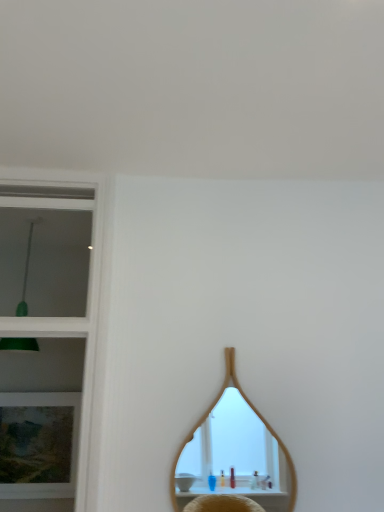
Measure the distance between point (204,466) and camera.

Point (204,466) and camera are 14.21 feet apart from each other.

Where is `wooden mirror at center`? wooden mirror at center is located at coordinates (235, 451).

The height and width of the screenshot is (512, 384). Describe the element at coordinates (235, 451) in the screenshot. I see `wooden mirror at center` at that location.

Consider the image. What is the approximate width of wooden mirror at center?

It is 0.92 inches.

At what (x,y) coordinates should I click in order to perform the action: click on matte wooden picture frame at left. Please return your answer as a coordinate pair (x, y). Looking at the image, I should click on pyautogui.click(x=38, y=444).

What do you see at coordinates (38, 444) in the screenshot? The width and height of the screenshot is (384, 512). I see `matte wooden picture frame at left` at bounding box center [38, 444].

Locate an element on the screen. Image resolution: width=384 pixels, height=512 pixels. wooden mirror at center is located at coordinates (235, 451).

Does matte wooden picture frame at left appear on the right side of wooden mirror at center?

Incorrect, matte wooden picture frame at left is not on the right side of wooden mirror at center.

Is matte wooden picture frame at left further to the viewer compared to wooden mirror at center?

Yes, the depth of matte wooden picture frame at left is greater than that of wooden mirror at center.

Does point (30, 434) lie in front of point (283, 457)?

Yes, it is.

From the image's perspective, relative to wooden mirror at center, is matte wooden picture frame at left above or below?

matte wooden picture frame at left is below wooden mirror at center.

From a real-world perspective, relative to wooden mirror at center, is matte wooden picture frame at left vertically above or below?

In terms of real-world spatial position, matte wooden picture frame at left is below wooden mirror at center.

Between matte wooden picture frame at left and wooden mirror at center, which one has larger width?

With larger width is matte wooden picture frame at left.

Between matte wooden picture frame at left and wooden mirror at center, which one has more height?

Standing taller between the two is wooden mirror at center.

Looking at the image, does matte wooden picture frame at left seem bigger or smaller compared to wooden mirror at center?

Clearly, matte wooden picture frame at left is larger in size than wooden mirror at center.

Choose the correct answer: Is matte wooden picture frame at left inside wooden mirror at center or outside it?

matte wooden picture frame at left is not enclosed by wooden mirror at center.

Is matte wooden picture frame at left far from wooden mirror at center?

matte wooden picture frame at left is far away from wooden mirror at center.

Is matte wooden picture frame at left looking in the opposite direction of wooden mirror at center?

No, wooden mirror at center is not at the back of matte wooden picture frame at left.

How different are the orientations of matte wooden picture frame at left and wooden mirror at center in degrees?

The angle between the facing direction of matte wooden picture frame at left and the facing direction of wooden mirror at center is 0.185 degrees.

How far apart are matte wooden picture frame at left and wooden mirror at center?

matte wooden picture frame at left and wooden mirror at center are 2.13 meters apart from each other.

The height and width of the screenshot is (512, 384). I want to click on picture frame below the wooden mirror at center (from a real-world perspective), so click(38, 444).

From the picture: Considering the relative positions of wooden mirror at center and matte wooden picture frame at left in the image provided, is wooden mirror at center to the right of matte wooden picture frame at left from the viewer's perspective?

Indeed, wooden mirror at center is positioned on the right side of matte wooden picture frame at left.

In the image, is wooden mirror at center positioned in front of or behind matte wooden picture frame at left?

Clearly, wooden mirror at center is in front of matte wooden picture frame at left.

Which is in front, point (278, 466) or point (20, 472)?

Point (20, 472)

From the image's perspective, which is above, wooden mirror at center or matte wooden picture frame at left?

wooden mirror at center.

From a real-world perspective, is wooden mirror at center beneath matte wooden picture frame at left?

Incorrect, from a real-world perspective, wooden mirror at center is higher than matte wooden picture frame at left.

Is wooden mirror at center wider or thinner than matte wooden picture frame at left?

Clearly, wooden mirror at center has less width compared to matte wooden picture frame at left.

Between wooden mirror at center and matte wooden picture frame at left, which one has more height?

wooden mirror at center is taller.

Who is bigger, wooden mirror at center or matte wooden picture frame at left?

matte wooden picture frame at left is bigger.

Is matte wooden picture frame at left a part of wooden mirror at center?

No, wooden mirror at center does not contain matte wooden picture frame at left.

Would you consider wooden mirror at center to be distant from matte wooden picture frame at left?

That's right, there is a large distance between wooden mirror at center and matte wooden picture frame at left.

In the scene shown: Is wooden mirror at center oriented towards matte wooden picture frame at left?

No, wooden mirror at center is not turned towards matte wooden picture frame at left.

Can you tell me how much wooden mirror at center and matte wooden picture frame at left differ in facing direction?

They differ by 0.185 degrees in their facing directions.

I want to click on picture frame below the wooden mirror at center (from the image's perspective), so click(x=38, y=444).

Identify the location of mirror located on the right of matte wooden picture frame at left. (235, 451).

Where is `picture frame that is below the wooden mirror at center (from the image's perspective)`? This screenshot has height=512, width=384. picture frame that is below the wooden mirror at center (from the image's perspective) is located at coordinates (38, 444).